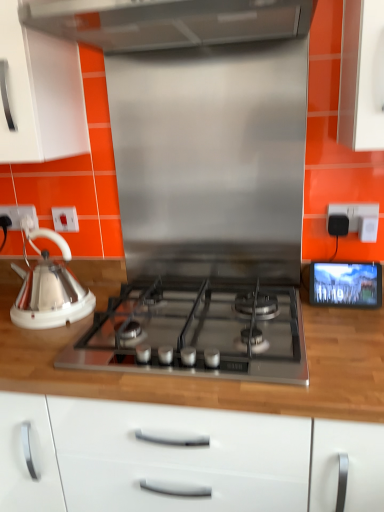
Question: Is white plastic electrical outlet at left, the second electric outlet from the back, next to white glossy kettle at left and touching it?

Choices:
 (A) yes
 (B) no

Answer: (B)

Question: From the image's perspective, does white plastic electrical outlet at left, the second electric outlet from the back, appear lower than white glossy kettle at left?

Choices:
 (A) no
 (B) yes

Answer: (A)

Question: Is white plastic electrical outlet at left, the second electric outlet from the back, wider than white glossy kettle at left?

Choices:
 (A) no
 (B) yes

Answer: (A)

Question: Is white plastic electrical outlet at left, the 2th electric outlet in the right-to-left sequence, bigger than white glossy kettle at left?

Choices:
 (A) yes
 (B) no

Answer: (B)

Question: Is white plastic electrical outlet at left, arranged as the second electric outlet when viewed from the left, oriented away from white glossy kettle at left?

Choices:
 (A) yes
 (B) no

Answer: (B)

Question: Does white plastic electrical outlet at left, the second electric outlet from the back, contain white glossy kettle at left?

Choices:
 (A) no
 (B) yes

Answer: (A)

Question: Is black plastic electric outlet at upper right, the 3th electric outlet when ordered from back to front, at the back of white glossy kettle at left?

Choices:
 (A) yes
 (B) no

Answer: (B)

Question: From a real-world perspective, is white glossy kettle at left located beneath black plastic electric outlet at upper right, the 3th electric outlet when ordered from back to front?

Choices:
 (A) no
 (B) yes

Answer: (B)

Question: Is white glossy kettle at left closer to the viewer compared to black plastic electric outlet at upper right, the 1th electric outlet positioned from the right?

Choices:
 (A) no
 (B) yes

Answer: (B)

Question: Considering the relative sizes of white glossy kettle at left and black plastic electric outlet at upper right, the 1th electric outlet positioned from the right, in the image provided, is white glossy kettle at left shorter than black plastic electric outlet at upper right, the 1th electric outlet positioned from the right,?

Choices:
 (A) yes
 (B) no

Answer: (B)

Question: Does white glossy kettle at left appear on the left side of black plastic electric outlet at upper right, the 1th electric outlet positioned from the right?

Choices:
 (A) no
 (B) yes

Answer: (B)

Question: Considering the relative sizes of white glossy kettle at left and black plastic electric outlet at upper right, which ranks as the third electric outlet in left-to-right order, in the image provided, is white glossy kettle at left thinner than black plastic electric outlet at upper right, which ranks as the third electric outlet in left-to-right order,?

Choices:
 (A) no
 (B) yes

Answer: (A)

Question: Considering the relative sizes of satin silver gas stove at center and white plastic socket at left, the first electric outlet when ordered from back to front, in the image provided, is satin silver gas stove at center taller than white plastic socket at left, the first electric outlet when ordered from back to front,?

Choices:
 (A) yes
 (B) no

Answer: (A)